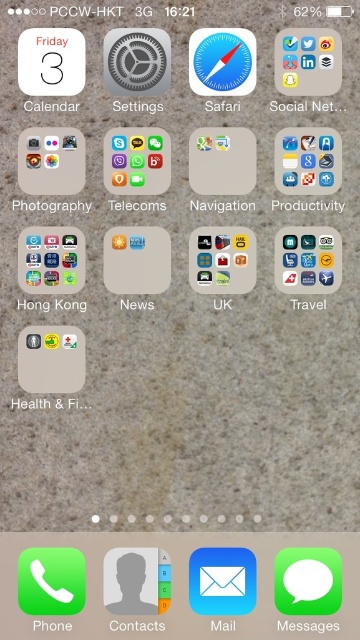
You are trying to locate the Messages app on your iPhone home screen. You remember that it is green and matte in appearance and positioned at the bottom right corner. There is also a black folder labeled Paper Hong Kong at the center of the screen. Which app is bigger in size between the black paper hong kong at center and the green matte messages at bottom right?

The black paper hong kong at center has a larger size compared to green matte messages at bottom right, so the black paper hong kong at center is bigger in size.